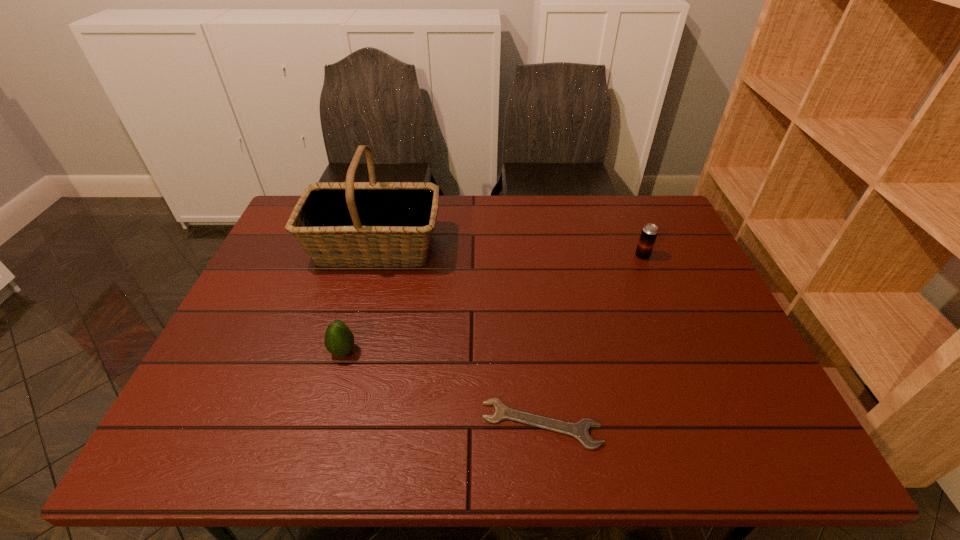
Identify the location of the closest object to the basket. coord(339,340).

Identify which object is the second closest to the avocado. Please provide its 2D coordinates. Your answer should be formatted as a tuple, i.e. [(x, y)], where the tuple contains the x and y coordinates of a point satisfying the conditions above.

[(580, 430)]

The height and width of the screenshot is (540, 960). What are the coordinates of `vacant space that satisfies the following two spatial constraints: 1. by the handle of the basket; 2. on the back side of the rightmost object` in the screenshot? It's located at (372, 256).

The height and width of the screenshot is (540, 960). Identify the location of free point that satisfies the following two spatial constraints: 1. by the handle of the shortest object; 2. on the left side of the tallest object. (326, 424).

The width and height of the screenshot is (960, 540). In order to click on blank space that satisfies the following two spatial constraints: 1. by the handle of the nearest object; 2. on the left side of the basket in this screenshot , I will do `click(326, 424)`.

This screenshot has height=540, width=960. Identify the location of vacant space that satisfies the following two spatial constraints: 1. on the back side of the nearest object; 2. by the handle of the tallest object. tap(522, 247).

You are a GUI agent. You are given a task and a screenshot of the screen. Output one action in this format:
    pyautogui.click(x=<x>, y=<y>)
    Task: Click on the free space that satisfies the following two spatial constraints: 1. by the handle of the basket; 2. on the back side of the nearest object
    This screenshot has height=540, width=960.
    Given the screenshot: What is the action you would take?
    pyautogui.click(x=326, y=424)

Locate an element on the screen. free space that satisfies the following two spatial constraints: 1. by the handle of the rightmost object; 2. on the left side of the basket is located at coordinates (372, 256).